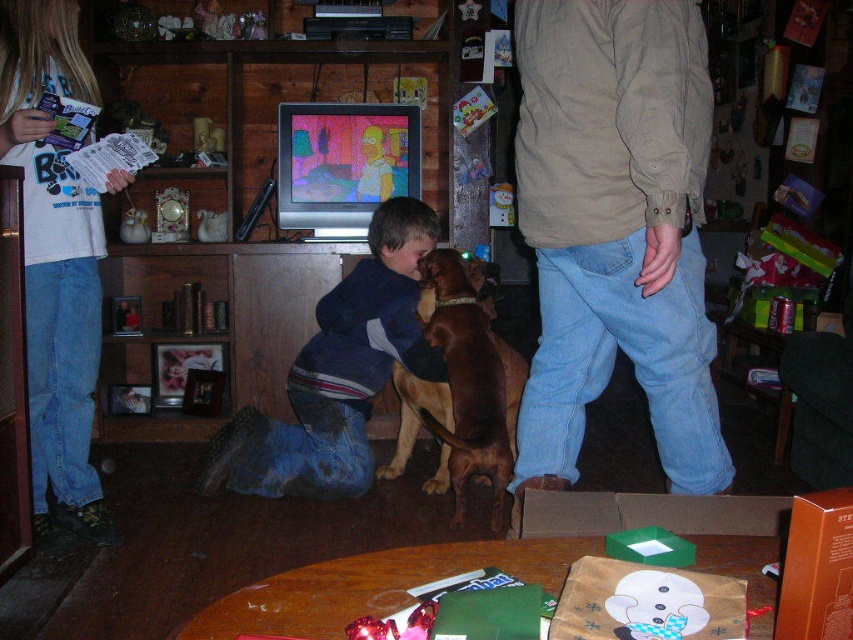
Question: Which is farther from the light brown corduroy shirt at center?

Choices:
 (A) denim jeans at center
 (B) orange cardboard box at lower right

Answer: (B)

Question: Based on their relative distances, which object is farther from the denim jeans at center?

Choices:
 (A) orange cardboard box at lower right
 (B) light brown corduroy shirt at center

Answer: (A)

Question: Does light brown corduroy shirt at center appear under orange cardboard box at lower right?

Choices:
 (A) yes
 (B) no

Answer: (B)

Question: Can you confirm if denim jeans at center is positioned to the right of brown shiny dog at center?

Choices:
 (A) no
 (B) yes

Answer: (A)

Question: Which point is closer to the camera taking this photo?

Choices:
 (A) (496, 401)
 (B) (845, 516)
 (C) (314, 416)
 (D) (683, 148)

Answer: (B)

Question: Can you confirm if denim jeans at center is positioned to the left of brown shiny dog at center?

Choices:
 (A) yes
 (B) no

Answer: (A)